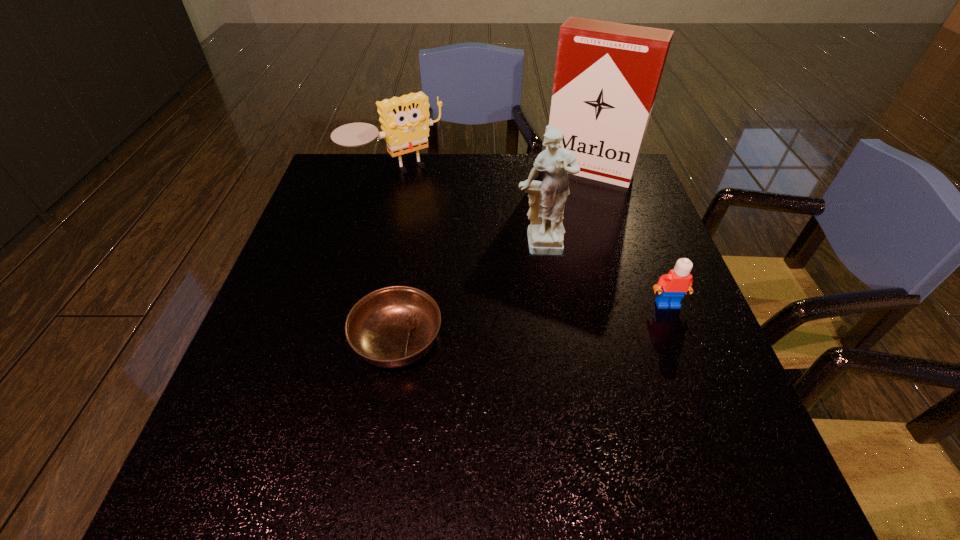
Image resolution: width=960 pixels, height=540 pixels. What are the coordinates of `soup bowl` in the screenshot? It's located at (392, 327).

The image size is (960, 540). I want to click on the fourth tallest object, so click(x=677, y=282).

Locate an element on the screen. This screenshot has height=540, width=960. the third shortest object is located at coordinates (405, 122).

Find the location of a particular element. The image size is (960, 540). the tallest object is located at coordinates (607, 74).

Image resolution: width=960 pixels, height=540 pixels. What are the coordinates of `figurine` in the screenshot? It's located at (547, 199).

This screenshot has width=960, height=540. Find the location of `the third farthest object`. the third farthest object is located at coordinates (547, 199).

You are a GUI agent. You are given a task and a screenshot of the screen. Output one action in this format:
    pyautogui.click(x=<x>, y=<y>)
    Task: Click on the free spot located on the back of the shortest object
    The width and height of the screenshot is (960, 540).
    Given the screenshot: What is the action you would take?
    408,273

At what (x,y) coordinates should I click in order to perform the action: click on free space located 0.110m on the face of the fourth tallest object. Please return your answer as a coordinate pair (x, y). The width and height of the screenshot is (960, 540). Looking at the image, I should click on coord(685,352).

The width and height of the screenshot is (960, 540). I want to click on vacant space located on the front-facing side of the third shortest object, so click(x=440, y=218).

Locate an element on the screen. This screenshot has width=960, height=540. vacant region located 0.100m on the front-facing side of the third shortest object is located at coordinates (431, 208).